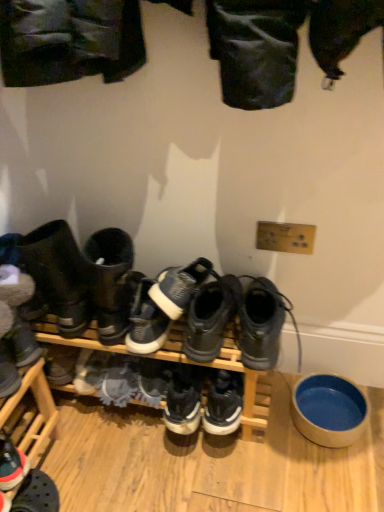
The width and height of the screenshot is (384, 512). I want to click on vacant position to the left of blue ceramic bowl at lower right, so click(x=269, y=446).